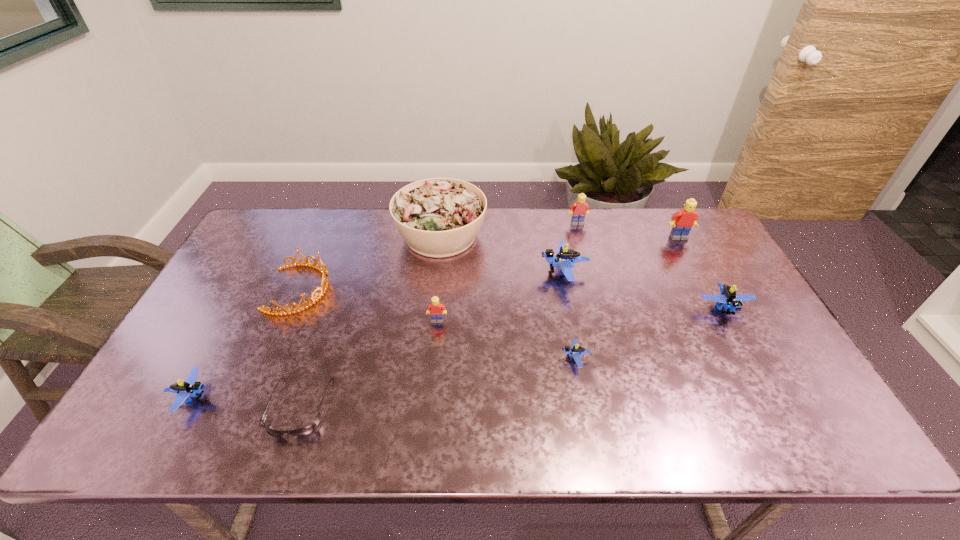
Identify which Lego is located as the sixth nearest to the farthest Lego. Please provide its 2D coordinates. Your answer should be formatted as a tuple, i.e. [(x, y)], where the tuple contains the x and y coordinates of a point satisfying the conditions above.

[(190, 388)]

This screenshot has height=540, width=960. I want to click on Lego that is the fifth closest one to the biggest blue Lego, so click(x=682, y=221).

Locate an element on the screen. The width and height of the screenshot is (960, 540). yellow Lego that can be found as the closest to the second biggest yellow Lego is located at coordinates (682, 221).

Identify which yellow Lego is the closest to the second yellow Lego from right to left. Please provide its 2D coordinates. Your answer should be formatted as a tuple, i.e. [(x, y)], where the tuple contains the x and y coordinates of a point satisfying the conditions above.

[(682, 221)]

Select which blue Lego is the third closest to the nearest blue Lego. Please provide its 2D coordinates. Your answer should be formatted as a tuple, i.e. [(x, y)], where the tuple contains the x and y coordinates of a point satisfying the conditions above.

[(732, 302)]

Locate which blue Lego ranks fourth in proximity to the salad. Please provide its 2D coordinates. Your answer should be formatted as a tuple, i.e. [(x, y)], where the tuple contains the x and y coordinates of a point satisfying the conditions above.

[(732, 302)]

Locate an element on the screen. The width and height of the screenshot is (960, 540). vacant position in the image that satisfies the following two spatial constraints: 1. on the front-facing side of the sixth nearest Lego; 2. on the front-facing side of the tiara is located at coordinates (707, 289).

At what (x,y) coordinates should I click in order to perform the action: click on blank space that satisfies the following two spatial constraints: 1. on the front-facing side of the second nearest yellow Lego; 2. on the front-facing side of the shortest Lego. Please return your answer as a coordinate pair (x, y). This screenshot has width=960, height=540. Looking at the image, I should click on pos(744,359).

The height and width of the screenshot is (540, 960). Find the location of `vacant space that satisfies the following two spatial constraints: 1. on the front-facing side of the biggest yellow Lego; 2. on the front-facing side of the tiara`. vacant space that satisfies the following two spatial constraints: 1. on the front-facing side of the biggest yellow Lego; 2. on the front-facing side of the tiara is located at coordinates (707, 289).

This screenshot has width=960, height=540. In order to click on vacant space that satisfies the following two spatial constraints: 1. on the front-facing side of the farthest Lego; 2. on the front-facing side of the leftmost Lego in this screenshot , I will do `click(625, 397)`.